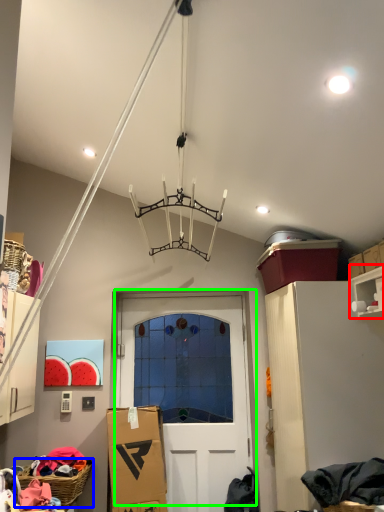
Question: Estimate the real-world distances between objects in this image. Which object is farther from shelf (highlighted by a red box), basket (highlighted by a blue box) or door (highlighted by a green box)?

Choices:
 (A) basket
 (B) door

Answer: (A)